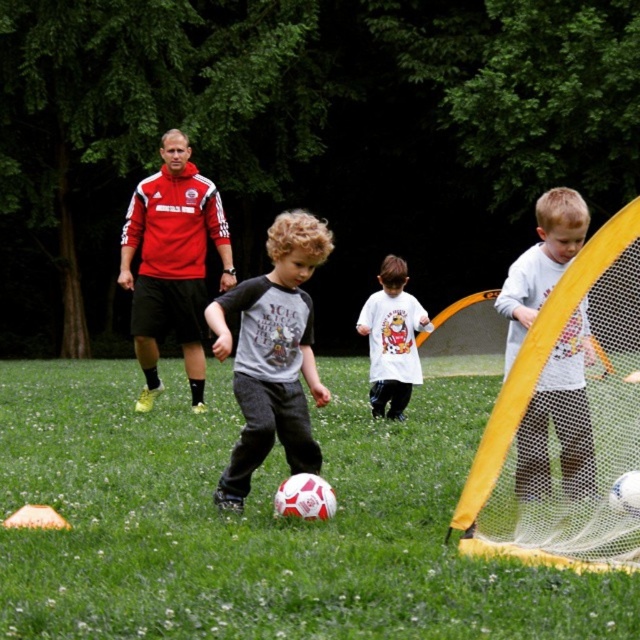
You are a photographer positioned behind the soccer ball. You need to take a photo of both the gray cotton shirt at center and the white matte shirt at right. Can you see both shirts in your current position?

The white matte shirt at right is behind the gray cotton shirt at center, so the photographer positioned behind the soccer ball cannot see the white matte shirt at right because it is obstructed by the gray cotton shirt at center.

You are a soccer coach analyzing the field layout. The soccer field has a coordinate system where the bottom left corner is the origin point. The goal is located at the top edge of the field. Based on the coordinates of the white matte soccer ball at center, is the ball closer to the goal or to the bottom edge of the field?

The white matte soccer ball at center is at position point (259, 520). Since the goal is at the top edge, the distance to the goal would be 1 minus the y coordinate, so 1 minus 0.405 equals 0.595. The distance to the bottom edge is just the y coordinate, 0.405. Since 0.405 is less than 0.595, the ball is closer to the bottom edge of the field.